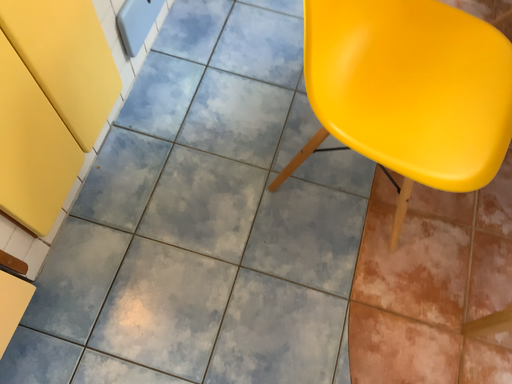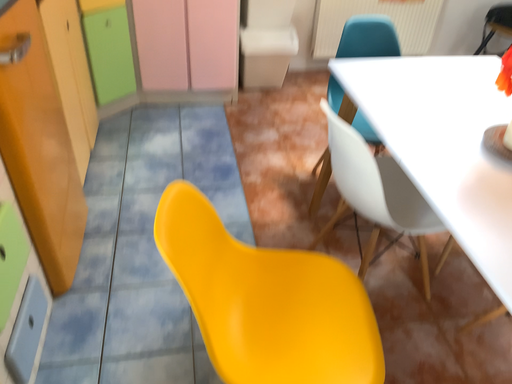
Question: How did the camera likely rotate when shooting the video?

Choices:
 (A) rotated downward
 (B) rotated upward

Answer: (B)